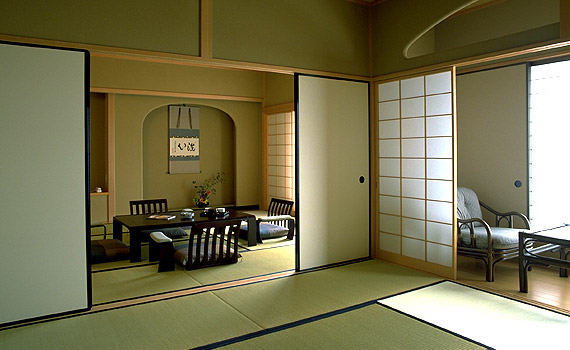
Where is `cushion`? This screenshot has width=570, height=350. cushion is located at coordinates (499, 240), (467, 206), (194, 245), (272, 230).